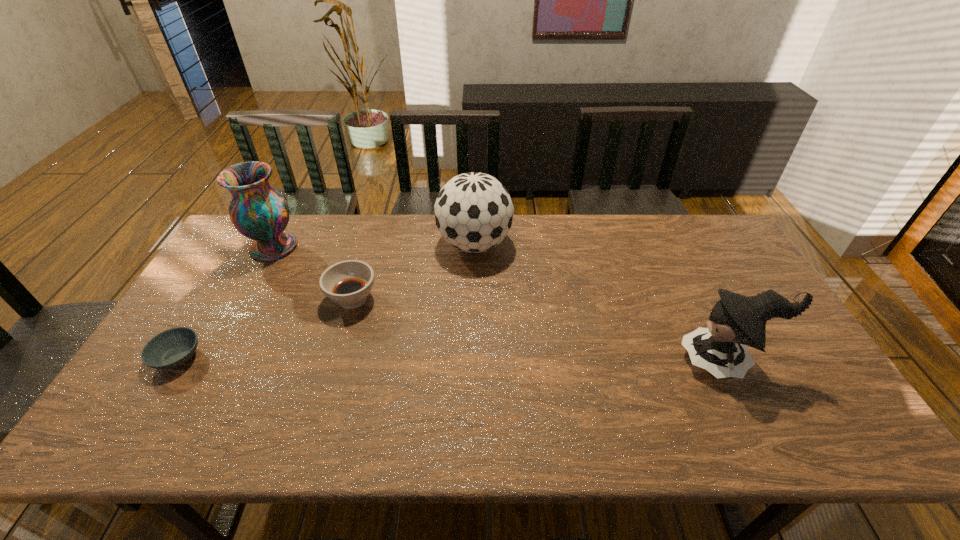
You are a GUI agent. You are given a task and a screenshot of the screen. Output one action in this format:
    pyautogui.click(x=<x>, y=<y>)
    Task: Click on the vase
    This screenshot has width=960, height=540.
    Given the screenshot: What is the action you would take?
    pyautogui.click(x=259, y=212)

Where is `soccer ball`? This screenshot has width=960, height=540. soccer ball is located at coordinates (473, 211).

You are a GUI agent. You are given a task and a screenshot of the screen. Output one action in this format:
    pyautogui.click(x=<x>, y=<y>)
    Task: Click on the rightmost object
    
    Given the screenshot: What is the action you would take?
    pyautogui.click(x=736, y=321)

The width and height of the screenshot is (960, 540). What are the coordinates of `the right soup bowl` in the screenshot? It's located at (348, 283).

At what (x,y) coordinates should I click in order to perform the action: click on the third farthest object. Please return your answer as a coordinate pair (x, y). The width and height of the screenshot is (960, 540). Looking at the image, I should click on (348, 283).

I want to click on the shorter soup bowl, so click(172, 348).

The image size is (960, 540). In order to click on the shortest object in this screenshot , I will do `click(172, 348)`.

Where is `free space located on the front of the vase`? This screenshot has width=960, height=540. free space located on the front of the vase is located at coordinates (226, 336).

Where is `free region located 0.360m on the front of the soccer ball`? This screenshot has width=960, height=540. free region located 0.360m on the front of the soccer ball is located at coordinates (472, 362).

Where is `blank area located 0.300m at the face of the doll`? blank area located 0.300m at the face of the doll is located at coordinates (564, 361).